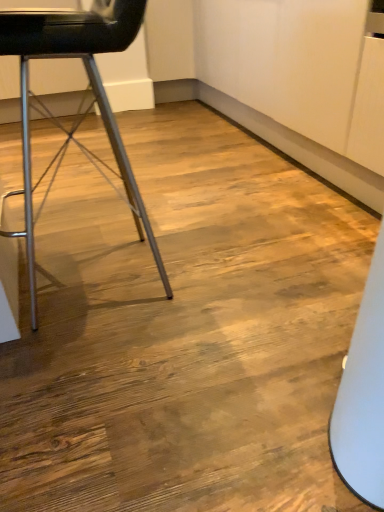
Locate an element on the screen. This screenshot has width=384, height=512. vacant space to the right of matte black chair at left is located at coordinates (247, 269).